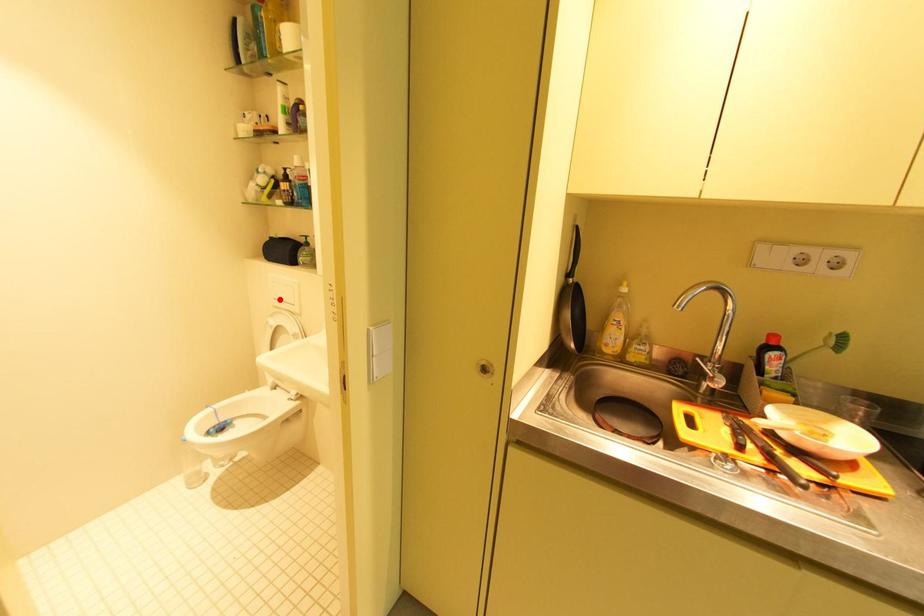
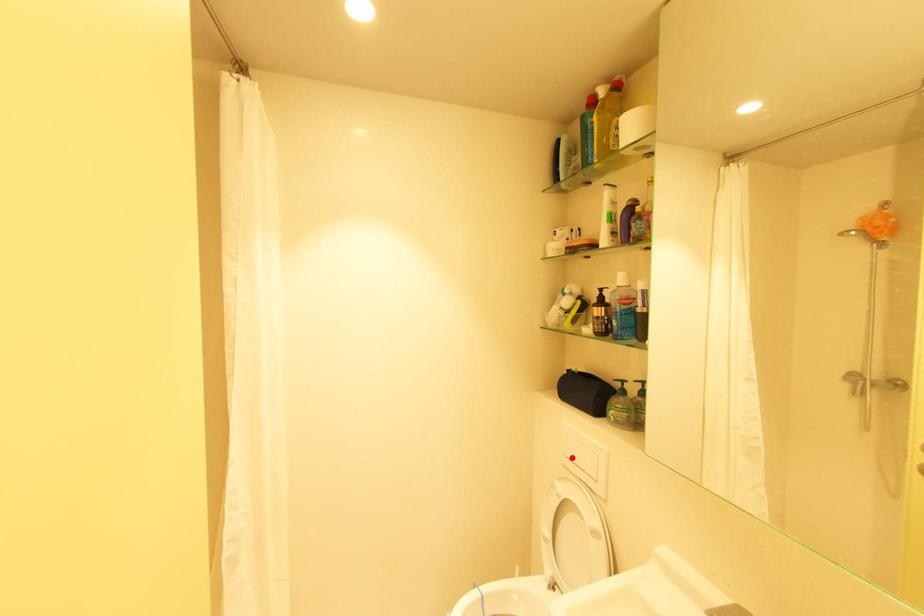
I am providing you with two images of the same scene from different viewpoints. A red point is marked on the first image and another point is marked on the second image. Does the point marked in image1 correspond to the same location as the one in image2?

Yes